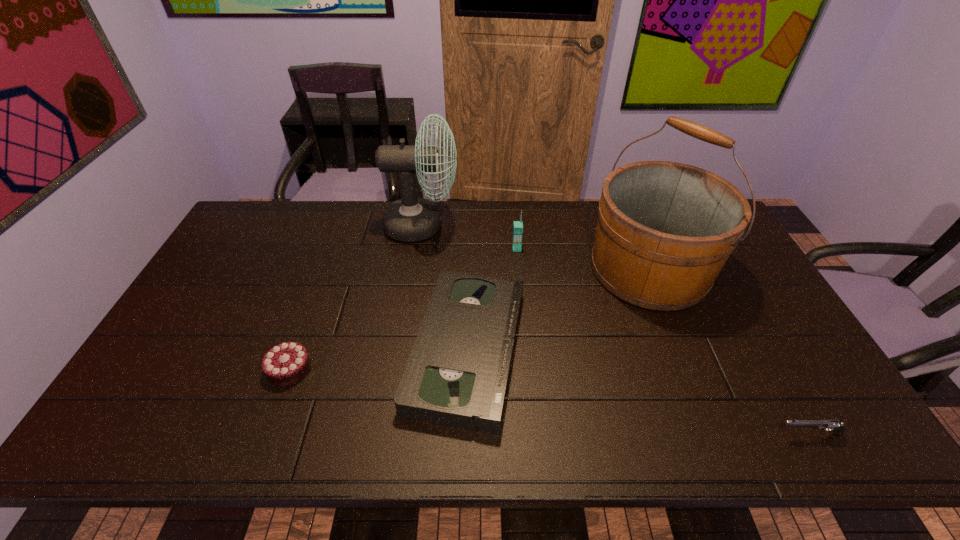
I want to click on vacant area between the videotape and the tallest object, so click(x=558, y=309).

Where is `free spot between the bucket and the fan`? The height and width of the screenshot is (540, 960). free spot between the bucket and the fan is located at coordinates (536, 247).

Where is `vacant area that lies between the cellular telephone and the tallest object`? vacant area that lies between the cellular telephone and the tallest object is located at coordinates (583, 259).

Where is `free space between the bucket and the cellular telephone`? The width and height of the screenshot is (960, 540). free space between the bucket and the cellular telephone is located at coordinates [x=583, y=259].

Locate an element on the screen. The width and height of the screenshot is (960, 540). unoccupied area between the tallest object and the videotape is located at coordinates (558, 309).

Find the location of a particular element. unoccupied position between the videotape and the tallest object is located at coordinates (558, 309).

The image size is (960, 540). I want to click on object identified as the fourth closest to the videotape, so click(285, 364).

Choose which object is the nearest neighbor to the fan. Please provide its 2D coordinates. Your answer should be formatted as a tuple, i.e. [(x, y)], where the tuple contains the x and y coordinates of a point satisfying the conditions above.

[(457, 374)]

Find the location of a particular element. This screenshot has width=960, height=540. vacant region that satisfies the following two spatial constraints: 1. on the keypad of the cellular telephone; 2. on the left side of the tallest object is located at coordinates (518, 269).